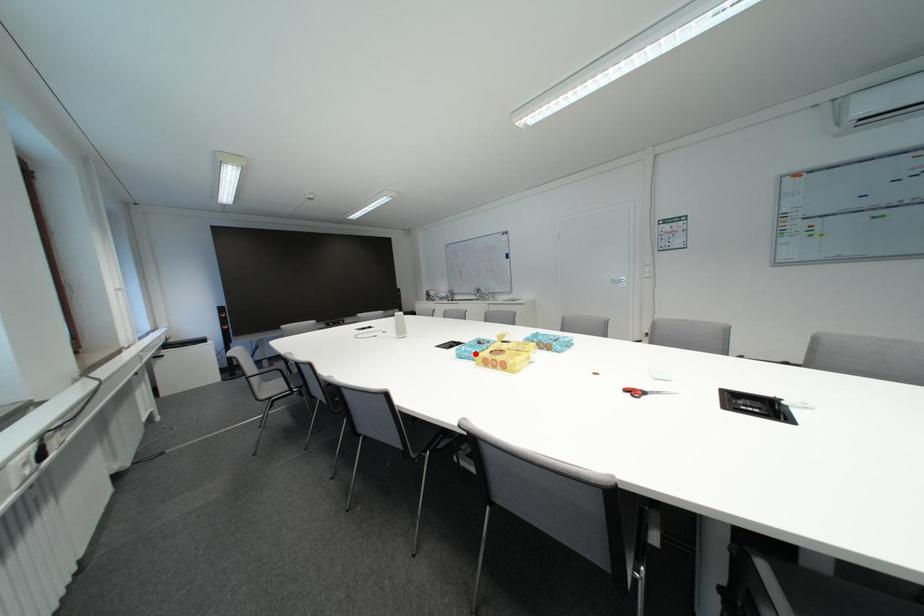
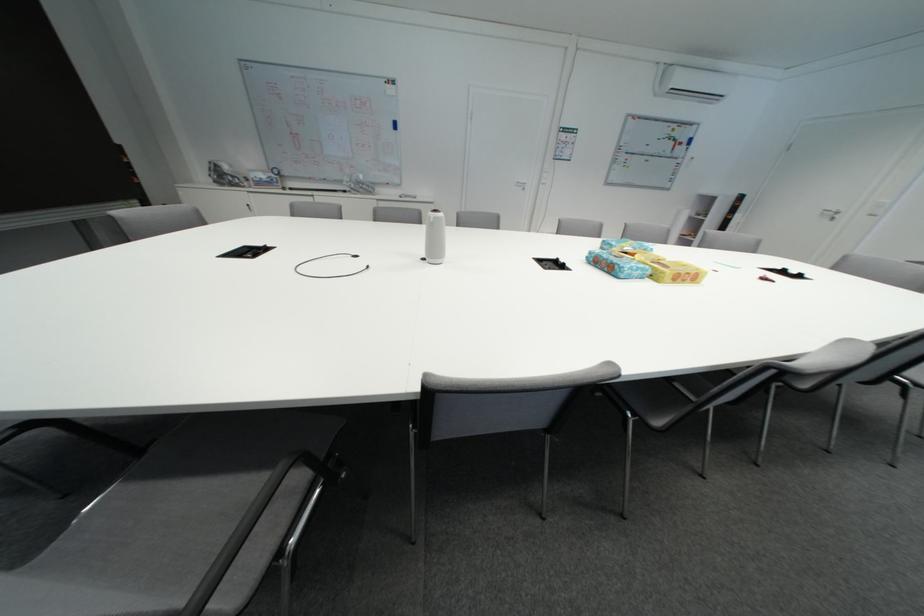
Where in the second image is the point corresponding to the highlighted location from the first image?

(648, 272)